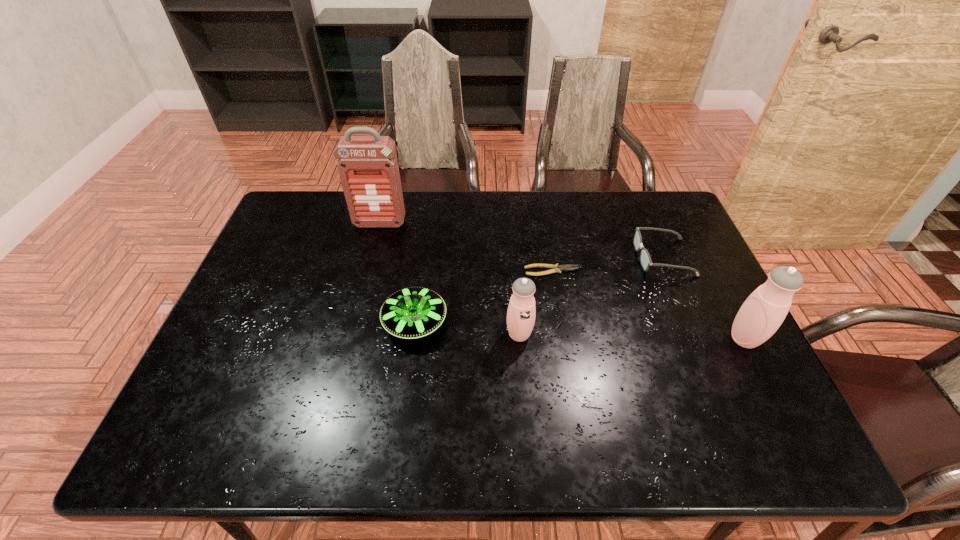
I want to click on free space at the far edge of the desktop, so click(x=542, y=192).

The width and height of the screenshot is (960, 540). What are the coordinates of `vacant space at the near edge` in the screenshot? It's located at (588, 393).

Where is `vacant space at the left edge of the desktop`? The height and width of the screenshot is (540, 960). vacant space at the left edge of the desktop is located at coordinates (259, 329).

In the image, there is a desktop. At what (x,y) coordinates should I click in order to perform the action: click on free space at the far left corner. Please return your answer as a coordinate pair (x, y). Looking at the image, I should click on (329, 208).

Image resolution: width=960 pixels, height=540 pixels. I want to click on vacant region at the far right corner of the desktop, so click(x=648, y=216).

At what (x,y) coordinates should I click in order to perform the action: click on unoccupied area between the right thermos bottle and the spectacles. Please return your answer as a coordinate pair (x, y). This screenshot has width=960, height=540. Looking at the image, I should click on (704, 298).

Where is `unoccupied area between the shorter thermos bottle and the shortest object`? unoccupied area between the shorter thermos bottle and the shortest object is located at coordinates (536, 302).

Locate an element on the screen. The image size is (960, 540). vacant area that lies between the saucer and the tallest object is located at coordinates (397, 273).

Locate an element on the screen. The image size is (960, 540). vacant area that lies between the spectacles and the third tallest object is located at coordinates (591, 296).

Find the location of `free point between the fourth tallest object and the shorter thermos bottle`. free point between the fourth tallest object and the shorter thermos bottle is located at coordinates (468, 328).